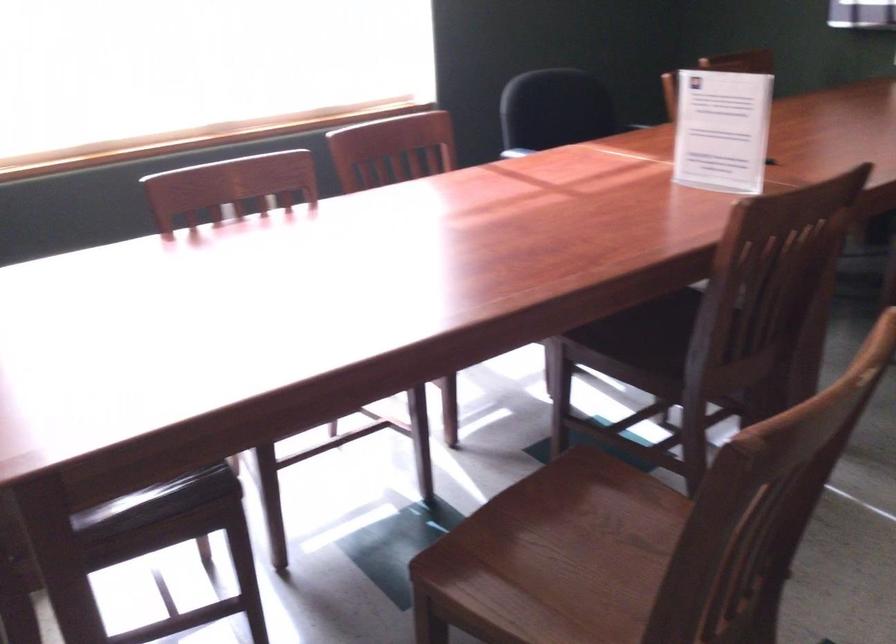
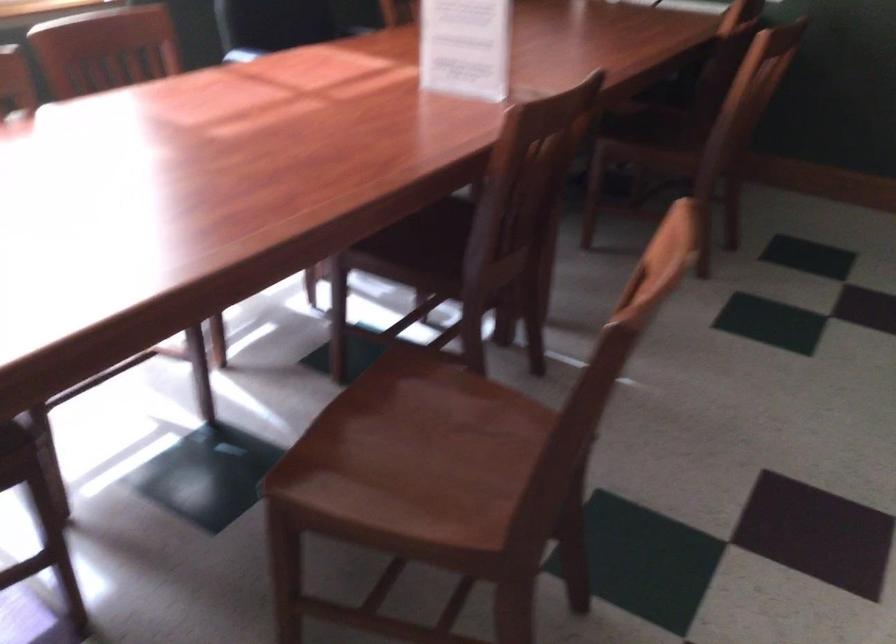
Where in the second image is the point corresponding to [570,565] from the first image?

(412, 458)